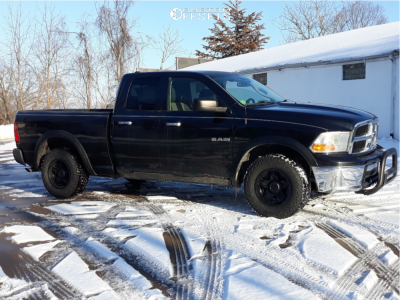
Where is `back door handle`? The width and height of the screenshot is (400, 300). back door handle is located at coordinates coord(126,120).